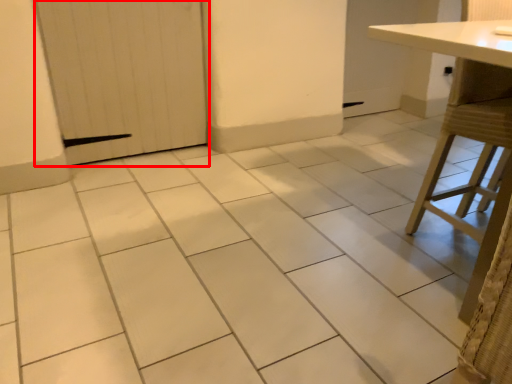
Question: In this image, where is door (annotated by the red box) located relative to table?

Choices:
 (A) right
 (B) left

Answer: (B)